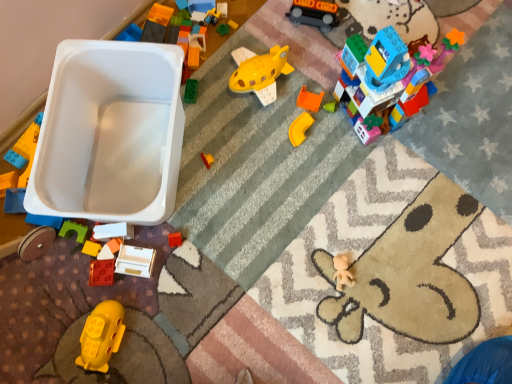
The width and height of the screenshot is (512, 384). I want to click on free space on the front side of multicolored plastic building block at upper right, which appears as the seventh toy when ordered from the bottom, so click(386, 173).